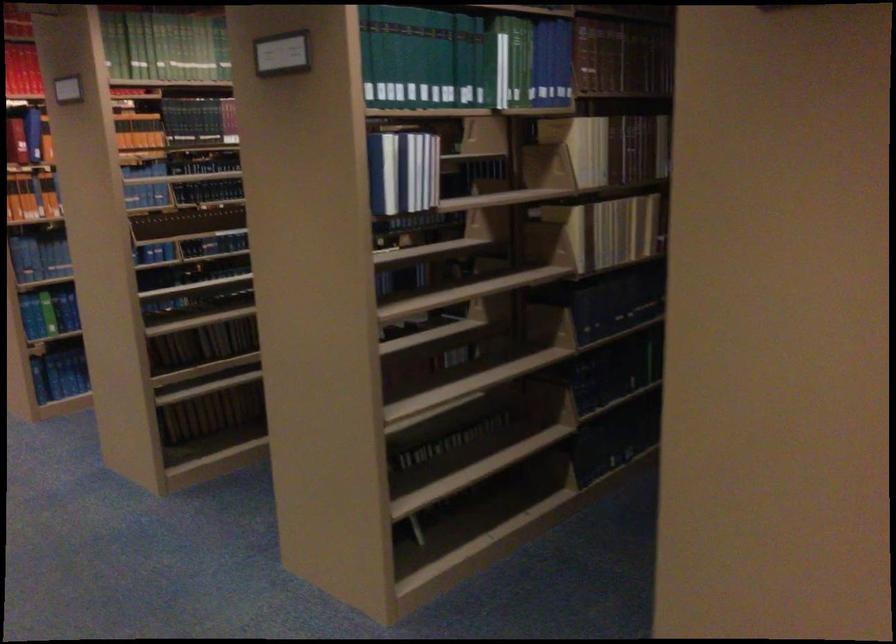
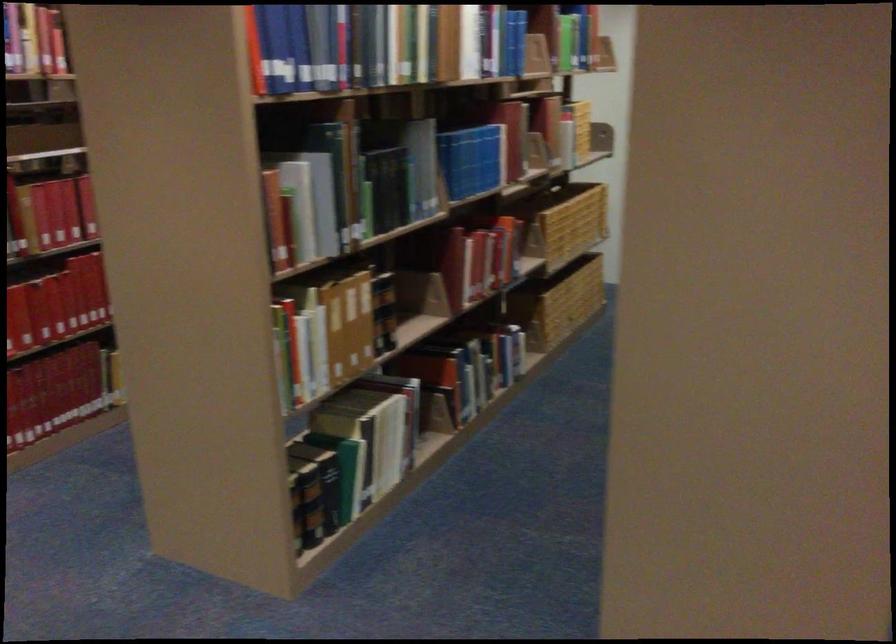
Which direction would the cameraman need to move to produce the second image?

The cameraman moved toward right, backward.